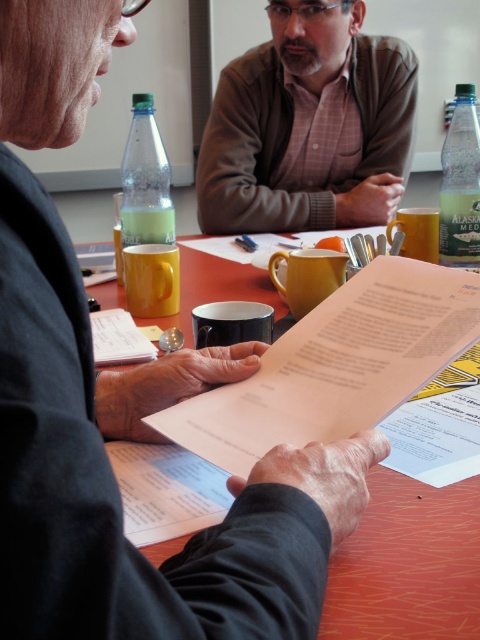
Is brown textured shirt at upper center bigger than white paper at center?

Yes.

In the scene shown: Can you confirm if brown textured shirt at upper center is wider than white paper at center?

Indeed, brown textured shirt at upper center has a greater width compared to white paper at center.

You are a GUI agent. You are given a task and a screenshot of the screen. Output one action in this format:
    pyautogui.click(x=<x>, y=<y>)
    Task: Click on the brown textured shirt at upper center
    The width and height of the screenshot is (480, 640).
    Given the screenshot: What is the action you would take?
    pyautogui.click(x=309, y=125)

Identify the location of brown textured shirt at upper center. This screenshot has width=480, height=640. (309, 125).

Is brown textured shirt at upper center positioned in front of translucent green plastic bottle at upper center?

No, it is behind translucent green plastic bottle at upper center.

Is brown textured shirt at upper center below translucent green plastic bottle at upper center?

Actually, brown textured shirt at upper center is above translucent green plastic bottle at upper center.

This screenshot has width=480, height=640. Identify the location of brown textured shirt at upper center. (309, 125).

Which of these two, wooden table at center or translucent green plastic bottle at upper center, stands taller?

Standing taller between the two is translucent green plastic bottle at upper center.

Who is lower down, wooden table at center or translucent green plastic bottle at upper center?

Positioned lower is wooden table at center.

The height and width of the screenshot is (640, 480). I want to click on wooden table at center, so click(411, 566).